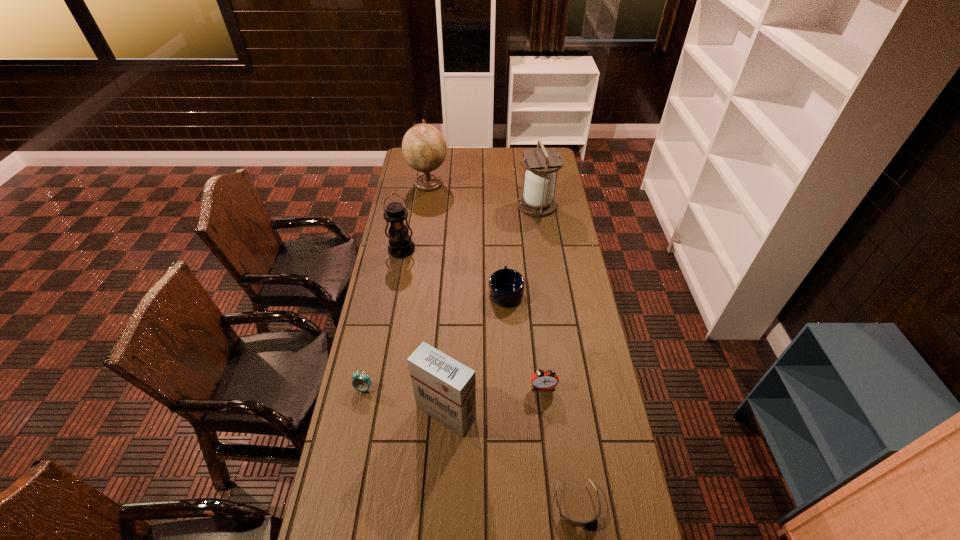
You are a GUI agent. You are given a task and a screenshot of the screen. Output one action in this format:
    pyautogui.click(x=<x>, y=<y>)
    Task: Click on the object that ranks as the fourth closest to the cigarette case
    
    Given the screenshot: What is the action you would take?
    pyautogui.click(x=506, y=286)

Where is `vacant area in the image that satisfies the following two spatial constraints: 1. on the front-facing side of the globe; 2. above the third farthest object, indicating its light source`? vacant area in the image that satisfies the following two spatial constraints: 1. on the front-facing side of the globe; 2. above the third farthest object, indicating its light source is located at coordinates (419, 250).

This screenshot has width=960, height=540. Find the location of `free point that satisfies the following two spatial constraints: 1. on the front-facing side of the globe; 2. above the third farthest object, indicating its light source`. free point that satisfies the following two spatial constraints: 1. on the front-facing side of the globe; 2. above the third farthest object, indicating its light source is located at coordinates (419, 250).

Image resolution: width=960 pixels, height=540 pixels. What are the coordinates of `vacant space that satisfies the following two spatial constraints: 1. with the handle on the side of the mug; 2. on the front-facing side of the globe` in the screenshot? It's located at (500, 183).

The width and height of the screenshot is (960, 540). Find the location of `vacant space that satisfies the following two spatial constraints: 1. on the front-facing side of the globe; 2. with the handle on the side of the mug`. vacant space that satisfies the following two spatial constraints: 1. on the front-facing side of the globe; 2. with the handle on the side of the mug is located at coordinates (413, 292).

At what (x,y) coordinates should I click in order to perform the action: click on free space that satisfies the following two spatial constraints: 1. on the front-facing side of the globe; 2. on the face of the left alarm clock. Please return your answer as a coordinate pair (x, y). This screenshot has width=960, height=540. Looking at the image, I should click on (398, 388).